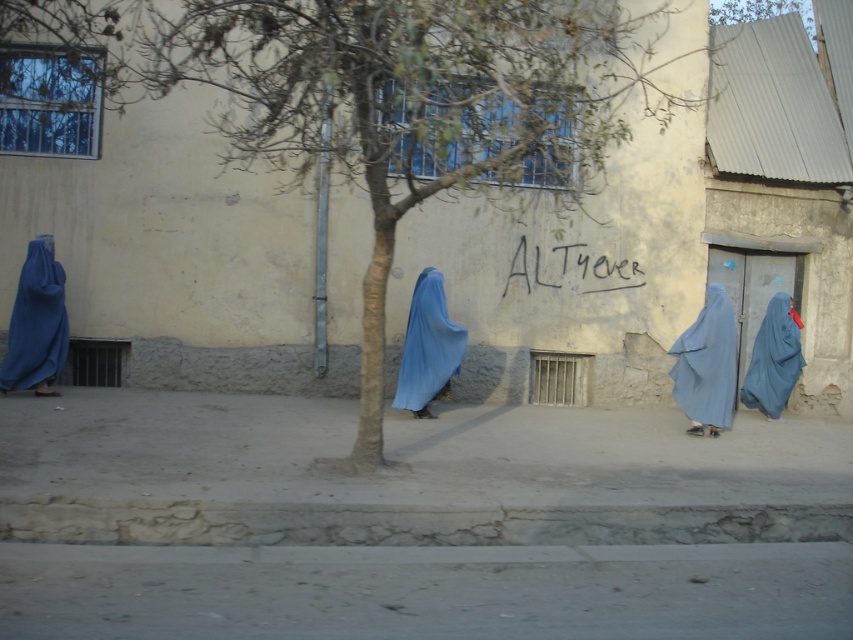
In the scene shown: You are standing on the sidewalk in the urban street scene. You see two points marked on the ground. The first point is at coordinate point (358, 77) and the second is at coordinate point (25, 346). Which point is closer to you?

Point (358, 77) is closer to the viewer than point (25, 346).

You are a photographer trying to capture the blue fabric burqa at left and the green leafy tree at center in the same frame. Based on their sizes, which object should you focus on first to ensure both are in the shot?

The green leafy tree at center is larger than the blue fabric burqa at left, so you should focus on the green leafy tree at center first to ensure both are in the shot.